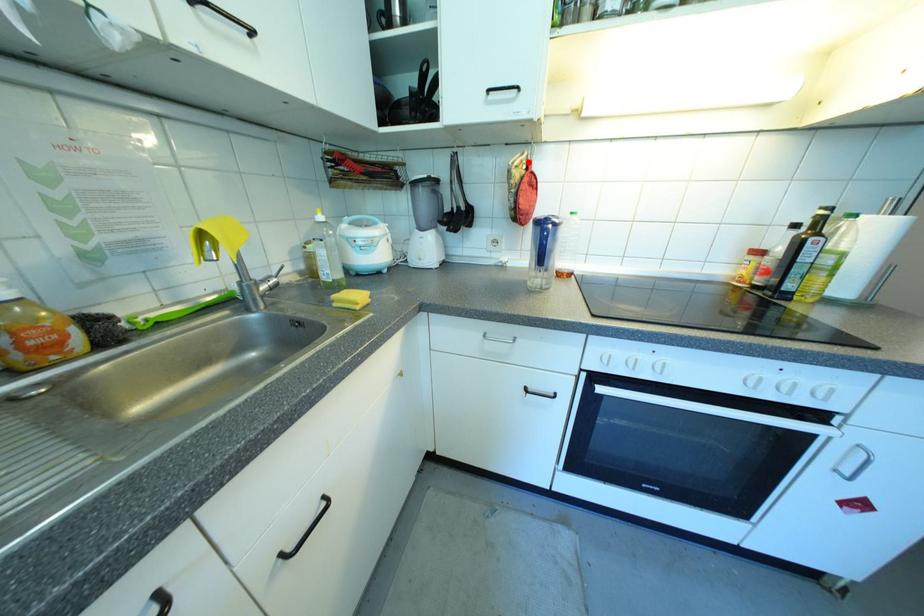
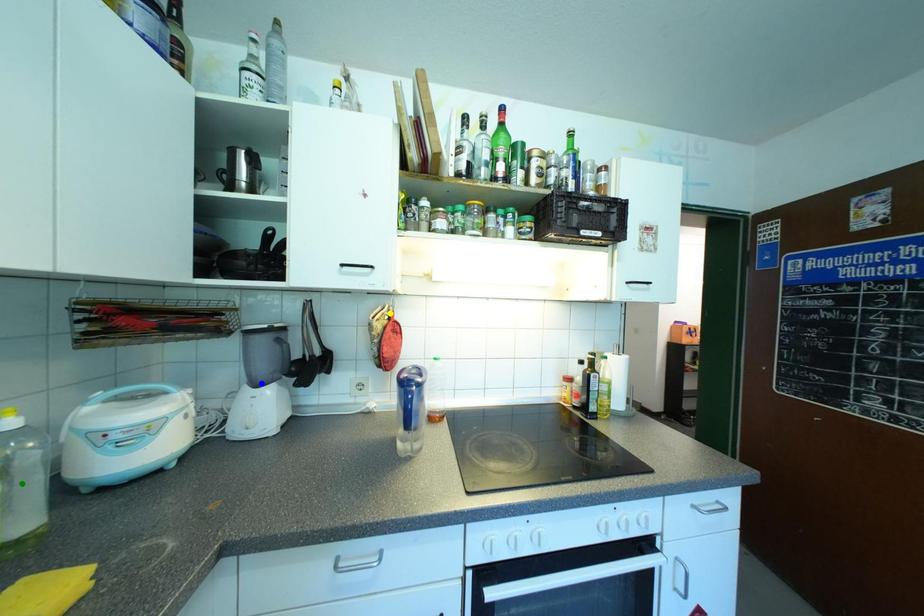
Question: I am providing you with two images of the same scene from different viewpoints. A red point is marked on the first image. You are given multiple points on the second image. Can you choose the point in image 2 that corresponds to the point in image 1?

Choices:
 (A) yellow point
 (B) blue point
 (C) green point

Answer: (A)